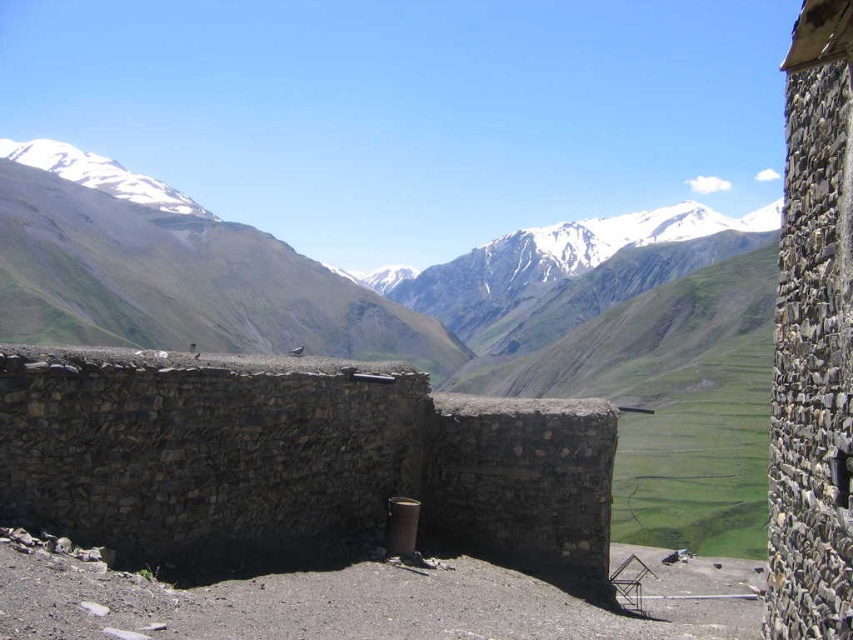
Question: Does gray stone wall at center have a smaller size compared to snowy rock mountain at center?

Choices:
 (A) yes
 (B) no

Answer: (A)

Question: Which of the following is the closest to the observer?

Choices:
 (A) click(207, 264)
 (B) click(521, 280)
 (C) click(198, 502)

Answer: (C)

Question: Is green grassy mountain at upper center below snowy rock mountain at center?

Choices:
 (A) yes
 (B) no

Answer: (B)

Question: Based on their relative distances, which object is nearer to the snowy rock mountain at center?

Choices:
 (A) green grassy mountain at upper center
 (B) gray stone wall at center

Answer: (A)

Question: Does gray stone wall at center have a larger size compared to snowy rock mountain at center?

Choices:
 (A) no
 (B) yes

Answer: (A)

Question: Estimate the real-world distances between objects in this image. Which object is farther from the gray stone wall at center?

Choices:
 (A) green grassy mountain at upper center
 (B) snowy rock mountain at center

Answer: (B)